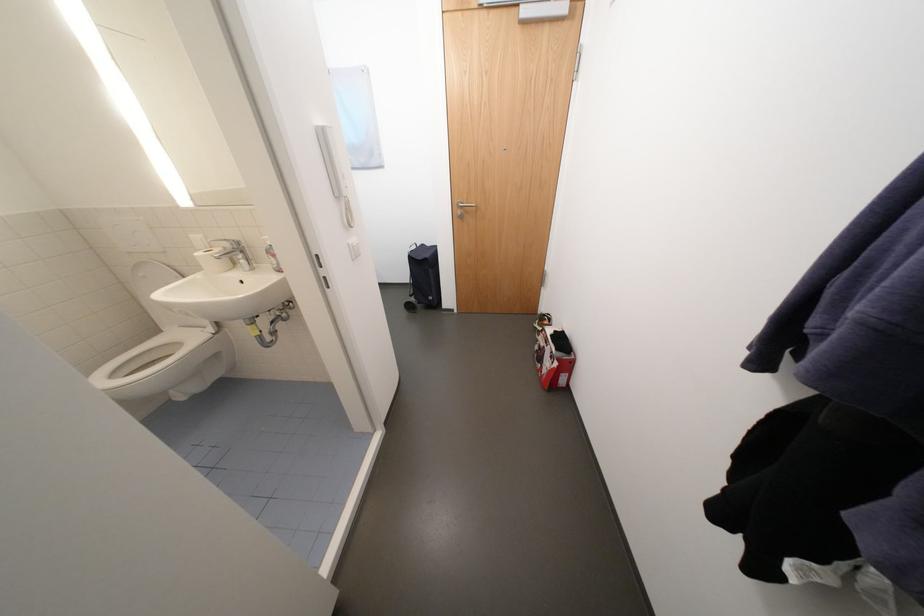
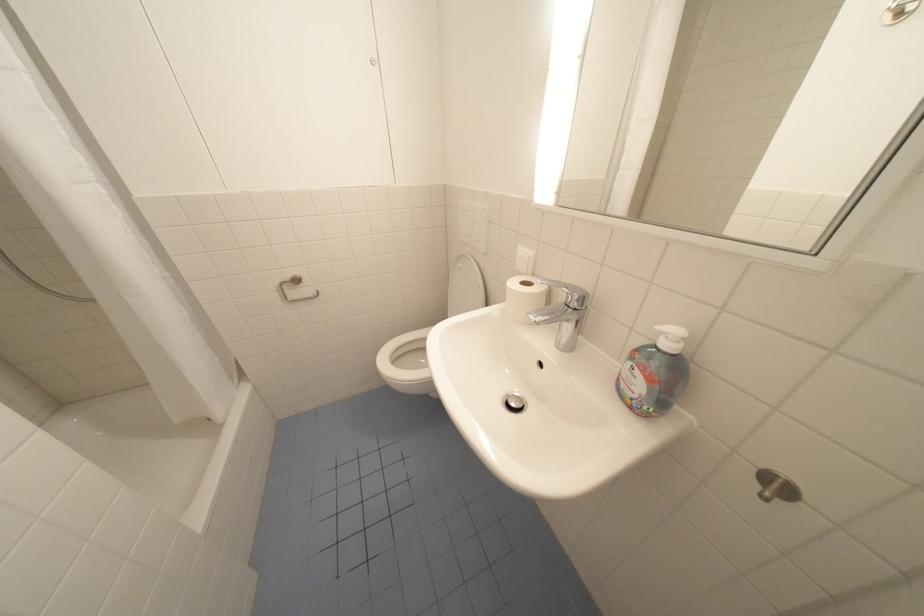
Where in the second image is the point corresponding to point 150,275 from the first image?

(468, 265)